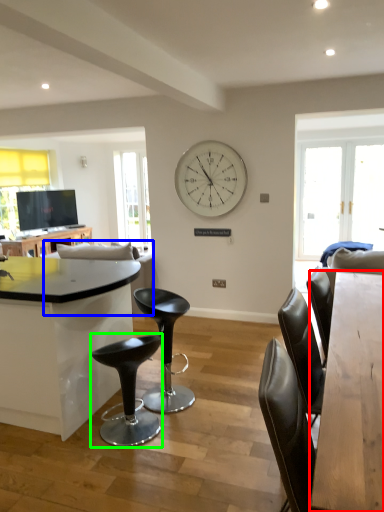
Question: Based on their relative distances, which object is farther from table (highlighted by a red box)? Choose from couch (highlighted by a blue box) and bar stool (highlighted by a green box).

Choices:
 (A) couch
 (B) bar stool

Answer: (A)